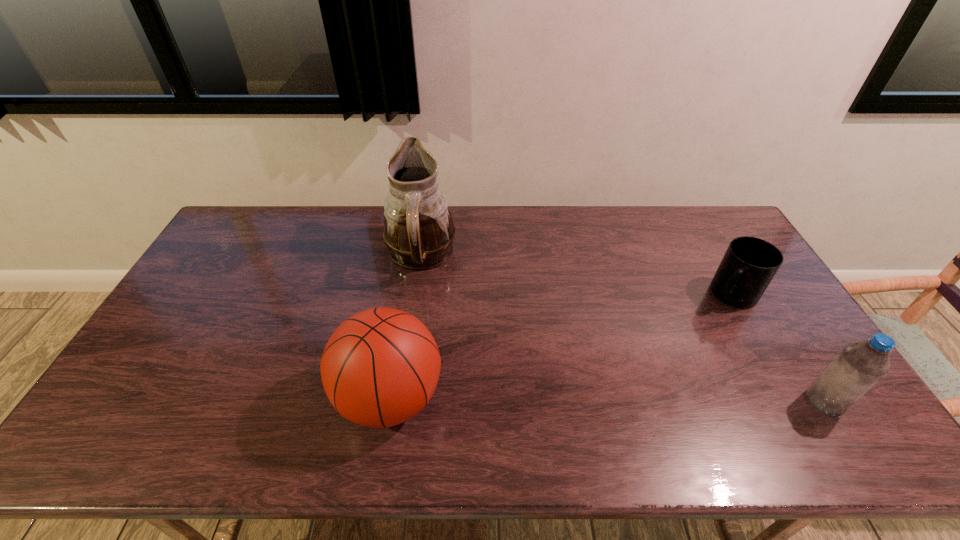
In order to click on vacant space located 0.100m on the side of the shortest object with the handle in this screenshot , I will do `click(704, 325)`.

The width and height of the screenshot is (960, 540). In order to click on vacant space located on the side of the shortest object with the handle in this screenshot , I will do `click(712, 316)`.

Locate an element on the screen. The height and width of the screenshot is (540, 960). object that is at the far edge is located at coordinates (418, 231).

At what (x,y) coordinates should I click in order to perform the action: click on basketball situated at the near edge. Please return your answer as a coordinate pair (x, y). Looking at the image, I should click on (381, 366).

The width and height of the screenshot is (960, 540). Find the location of `water bottle that is positioned at the near edge`. water bottle that is positioned at the near edge is located at coordinates (859, 366).

Locate an element on the screen. The width and height of the screenshot is (960, 540). water bottle that is at the right edge is located at coordinates (859, 366).

Locate an element on the screen. mug present at the right edge is located at coordinates (749, 264).

Find the location of a particular element. object located in the near right corner section of the desktop is located at coordinates (859, 366).

In order to click on vacant space at the far edge in this screenshot , I will do `click(294, 208)`.

This screenshot has width=960, height=540. I want to click on free location at the near edge, so click(546, 385).